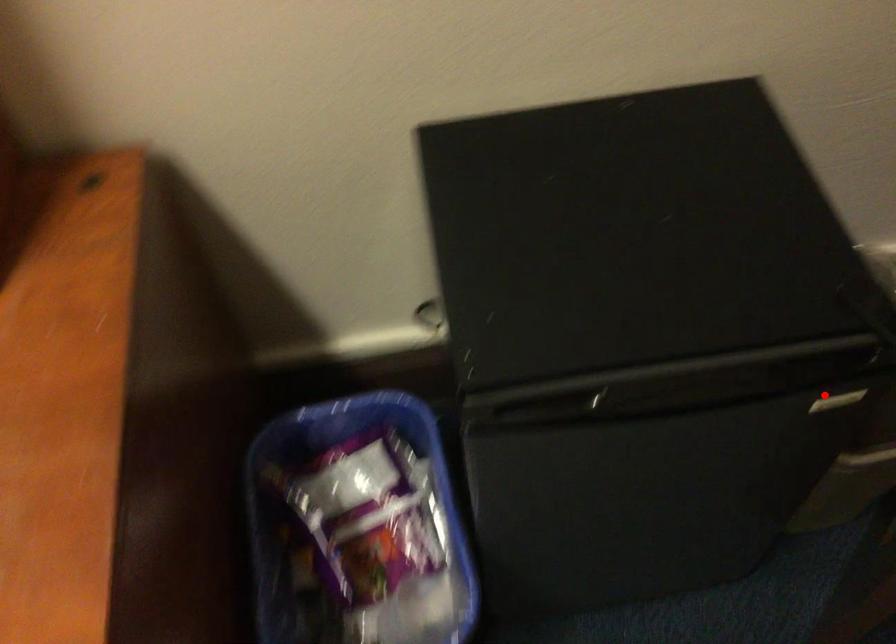
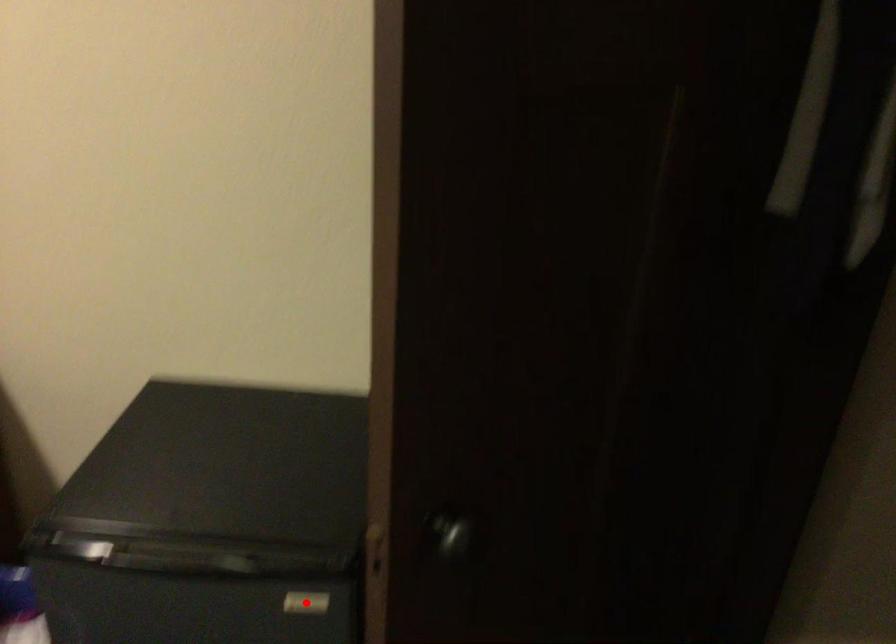
I am providing you with two images of the same scene from different viewpoints. A red point is marked on the first image and another point is marked on the second image. Does the point marked in image1 correspond to the same location as the one in image2?

Yes